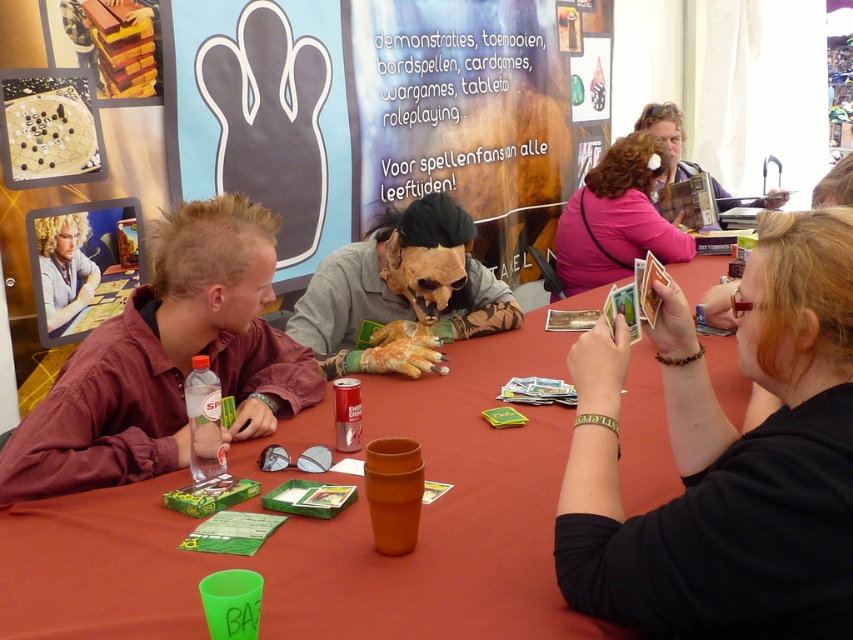
Question: Is the position of black matte card at center more distant than that of matte black hair at upper left?

Choices:
 (A) yes
 (B) no

Answer: (B)

Question: Which object is closer to the camera taking this photo?

Choices:
 (A) black matte card at center
 (B) smooth plastic cup at center
 (C) matte black hair at upper left

Answer: (A)

Question: Which object is positioned farthest from the smooth plastic cup at center?

Choices:
 (A) matte maroon shirt at lower left
 (B) pink fabric purse at upper center
 (C) black matte card at center

Answer: (B)

Question: Is smooth plastic cup at center closer to the viewer compared to matte black hair at upper left?

Choices:
 (A) no
 (B) yes

Answer: (B)

Question: Does smooth plastic cup at center appear under smooth gray mask at center?

Choices:
 (A) no
 (B) yes

Answer: (B)

Question: Based on their relative distances, which object is farther from the matte maroon shirt at lower left?

Choices:
 (A) matte black hair at upper left
 (B) smooth plastic cup at center
 (C) black matte card at center
 (D) smooth gray mask at center

Answer: (A)